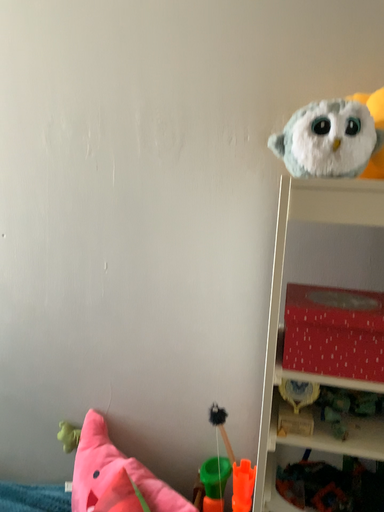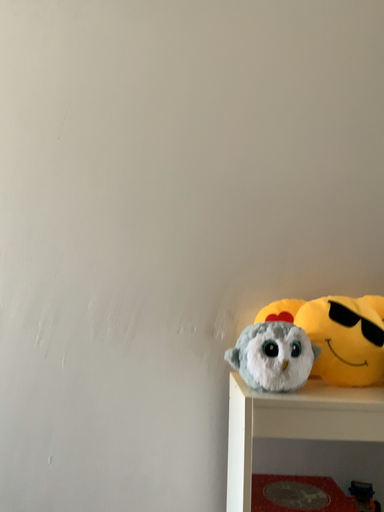
Question: How did the camera likely rotate when shooting the video?

Choices:
 (A) rotated upward
 (B) rotated downward

Answer: (A)